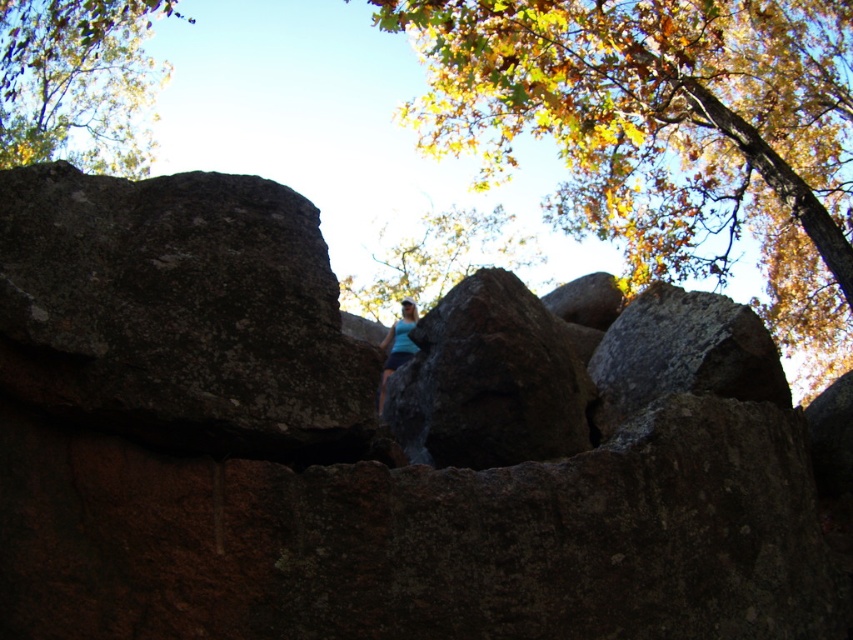
Does green leafy tree at upper left have a smaller size compared to green leafy tree at center?

Actually, green leafy tree at upper left might be larger than green leafy tree at center.

Is green leafy tree at upper left wider than green leafy tree at center?

Indeed, green leafy tree at upper left has a greater width compared to green leafy tree at center.

Who is more forward, (59,125) or (436,264)?

Point (59,125) is more forward.

Image resolution: width=853 pixels, height=640 pixels. What are the coordinates of `green leafy tree at upper left` in the screenshot? It's located at (77, 81).

Can you confirm if rusty stone boulder at center is thinner than blue fabric at center?

No.

Which of these two, rusty stone boulder at center or blue fabric at center, stands shorter?

With less height is blue fabric at center.

The height and width of the screenshot is (640, 853). I want to click on rusty stone boulder at center, so click(x=332, y=458).

Is yellow-green leaves at upper center to the right of rough textured rock at center from the viewer's perspective?

Yes, yellow-green leaves at upper center is to the right of rough textured rock at center.

Can you confirm if yellow-green leaves at upper center is smaller than rough textured rock at center?

Incorrect, yellow-green leaves at upper center is not smaller in size than rough textured rock at center.

At what (x,y) coordinates should I click in order to perform the action: click on yellow-green leaves at upper center. Please return your answer as a coordinate pair (x, y). Looking at the image, I should click on (666, 132).

Where is `yellow-green leaves at upper center`? The height and width of the screenshot is (640, 853). yellow-green leaves at upper center is located at coordinates (666, 132).